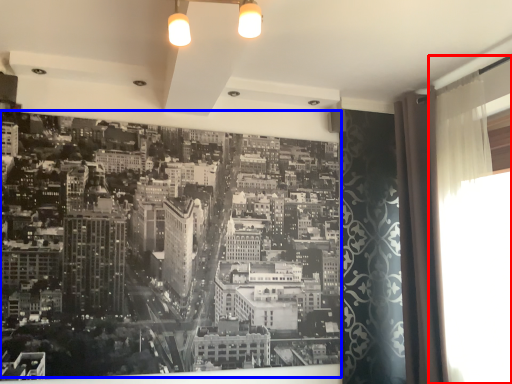
Question: Among these objects, which one is nearest to the camera, window screen (highlighted by a red box) or hotel (highlighted by a blue box)?

Choices:
 (A) window screen
 (B) hotel

Answer: (A)